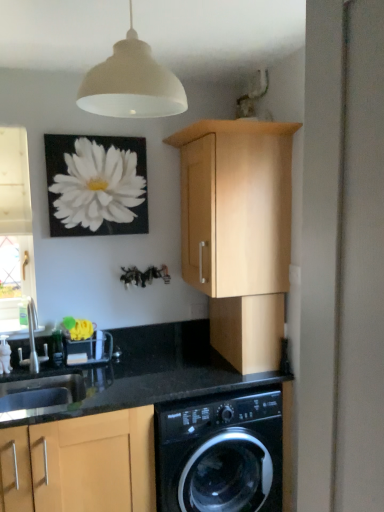
Question: Does silver metallic faucet at lower left have a greater width compared to clear glass window at left?

Choices:
 (A) no
 (B) yes

Answer: (B)

Question: Is silver metallic faucet at lower left outside clear glass window at left?

Choices:
 (A) no
 (B) yes

Answer: (B)

Question: Is silver metallic faucet at lower left to the left of clear glass window at left from the viewer's perspective?

Choices:
 (A) yes
 (B) no

Answer: (B)

Question: Does silver metallic faucet at lower left appear on the right side of clear glass window at left?

Choices:
 (A) no
 (B) yes

Answer: (B)

Question: Is silver metallic faucet at lower left oriented away from clear glass window at left?

Choices:
 (A) no
 (B) yes

Answer: (B)

Question: Considering the relative sizes of silver metallic faucet at lower left and clear glass window at left in the image provided, is silver metallic faucet at lower left shorter than clear glass window at left?

Choices:
 (A) no
 (B) yes

Answer: (B)

Question: Is light wood cabinet at upper center, which is counted as the first cabinetry, starting from the top, further to the viewer compared to white matte flower at upper left?

Choices:
 (A) no
 (B) yes

Answer: (A)

Question: Is light wood cabinet at upper center, acting as the 3th cabinetry starting from the bottom, smaller than white matte flower at upper left?

Choices:
 (A) no
 (B) yes

Answer: (A)

Question: From the image's perspective, is light wood cabinet at upper center, which is counted as the first cabinetry, starting from the top, beneath white matte flower at upper left?

Choices:
 (A) yes
 (B) no

Answer: (A)

Question: Would you say light wood cabinet at upper center, acting as the 3th cabinetry starting from the bottom, is outside white matte flower at upper left?

Choices:
 (A) no
 (B) yes

Answer: (B)

Question: Can you confirm if light wood cabinet at upper center, acting as the 3th cabinetry starting from the bottom, is shorter than white matte flower at upper left?

Choices:
 (A) no
 (B) yes

Answer: (A)

Question: Can you confirm if light wood cabinet at upper center, acting as the 3th cabinetry starting from the bottom, is bigger than white matte flower at upper left?

Choices:
 (A) no
 (B) yes

Answer: (B)

Question: Would you say white matte flower at upper left contains light wood cabinet at upper center, acting as the 3th cabinetry starting from the bottom?

Choices:
 (A) yes
 (B) no

Answer: (B)